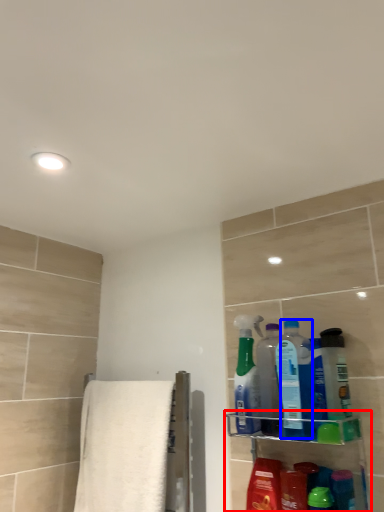
Question: Which of the following is the farthest to the observer, shelf (highlighted by a red box) or cleaning product (highlighted by a blue box)?

Choices:
 (A) shelf
 (B) cleaning product

Answer: (B)